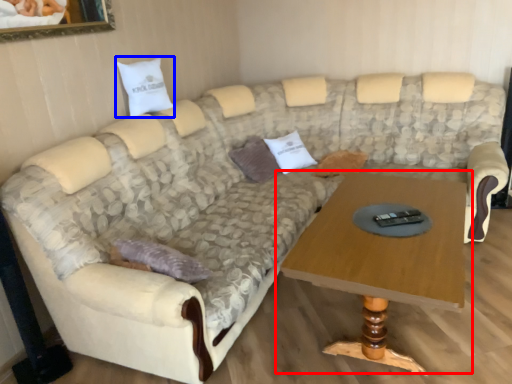
Question: Which object appears farthest to the camera in this image, coffee table (highlighted by a red box) or pillow (highlighted by a blue box)?

Choices:
 (A) coffee table
 (B) pillow

Answer: (B)